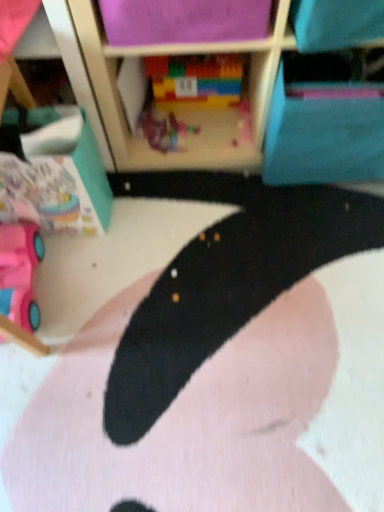
Question: Does plastic toy at center, which is counted as the second toy, starting from the left, have a lesser width compared to multicolored plastic blocks at center, positioned as the third toy in left-to-right order?

Choices:
 (A) yes
 (B) no

Answer: (B)

Question: From a real-world perspective, is plastic toy at center, acting as the second toy starting from the bottom, physically below multicolored plastic blocks at center, the 1th toy positioned from the right?

Choices:
 (A) no
 (B) yes

Answer: (B)

Question: Does plastic toy at center, acting as the second toy starting from the bottom, have a smaller size compared to multicolored plastic blocks at center, the 1th toy positioned from the right?

Choices:
 (A) no
 (B) yes

Answer: (B)

Question: From the image's perspective, is plastic toy at center, acting as the second toy starting from the bottom, over multicolored plastic blocks at center, the 1th toy positioned from the right?

Choices:
 (A) no
 (B) yes

Answer: (A)

Question: Considering the relative sizes of plastic toy at center, which is counted as the second toy, starting from the left, and multicolored plastic blocks at center, the 1th toy positioned from the right, in the image provided, is plastic toy at center, which is counted as the second toy, starting from the left, taller than multicolored plastic blocks at center, the 1th toy positioned from the right,?

Choices:
 (A) no
 (B) yes

Answer: (A)

Question: Is plastic toy at center, which is counted as the second toy, starting from the left, further to the viewer compared to multicolored plastic blocks at center, which is the 3th toy from bottom to top?

Choices:
 (A) yes
 (B) no

Answer: (A)

Question: Is black matte rug at center aimed at multicolored plastic blocks at center, the 1th toy positioned from the right?

Choices:
 (A) no
 (B) yes

Answer: (A)

Question: Can you see black matte rug at center touching multicolored plastic blocks at center, which is the 3th toy from bottom to top?

Choices:
 (A) no
 (B) yes

Answer: (A)

Question: From the image's perspective, would you say black matte rug at center is positioned over multicolored plastic blocks at center, which is the 3th toy from bottom to top?

Choices:
 (A) no
 (B) yes

Answer: (A)

Question: Considering the relative positions of black matte rug at center and multicolored plastic blocks at center, placed as the first toy when sorted from top to bottom, in the image provided, is black matte rug at center to the left of multicolored plastic blocks at center, placed as the first toy when sorted from top to bottom, from the viewer's perspective?

Choices:
 (A) no
 (B) yes

Answer: (A)

Question: Considering the relative sizes of black matte rug at center and multicolored plastic blocks at center, which is the 3th toy from bottom to top, in the image provided, is black matte rug at center wider than multicolored plastic blocks at center, which is the 3th toy from bottom to top,?

Choices:
 (A) yes
 (B) no

Answer: (A)

Question: Is black matte rug at center completely or partially outside of multicolored plastic blocks at center, which is the 3th toy from bottom to top?

Choices:
 (A) yes
 (B) no

Answer: (A)

Question: Is plastic toy at center, acting as the second toy starting from the bottom, at the right side of pink plastic toy car at lower left, marked as the first toy in a left-to-right arrangement?

Choices:
 (A) no
 (B) yes

Answer: (B)